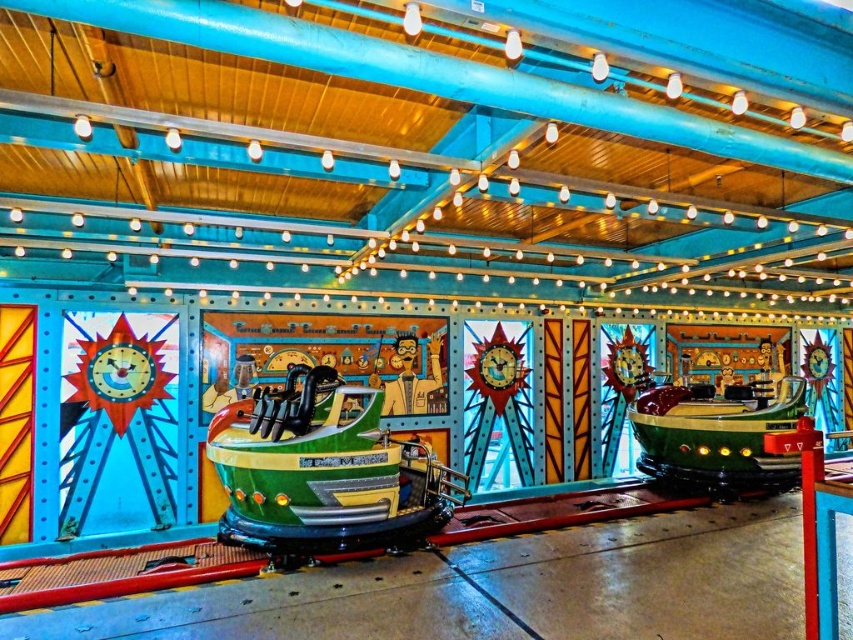
Question: Among these objects, which one is farthest from the camera?

Choices:
 (A) green shiny boat at center
 (B) green matte boat at center

Answer: (B)

Question: Is green shiny boat at center to the left of green matte boat at center from the viewer's perspective?

Choices:
 (A) no
 (B) yes

Answer: (B)

Question: Which point is closer to the camera?

Choices:
 (A) (374, 417)
 (B) (752, 484)

Answer: (A)

Question: Which point appears closest to the camera in this image?

Choices:
 (A) (407, 454)
 (B) (738, 464)

Answer: (A)

Question: Can you confirm if green shiny boat at center is thinner than green matte boat at center?

Choices:
 (A) no
 (B) yes

Answer: (A)

Question: Does green shiny boat at center appear over green matte boat at center?

Choices:
 (A) yes
 (B) no

Answer: (B)